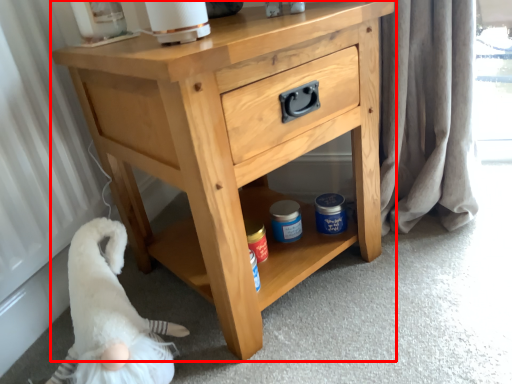
Question: Observing the image, what is the correct spatial positioning of chest of drawers (annotated by the red box) in reference to animal?

Choices:
 (A) left
 (B) right

Answer: (B)